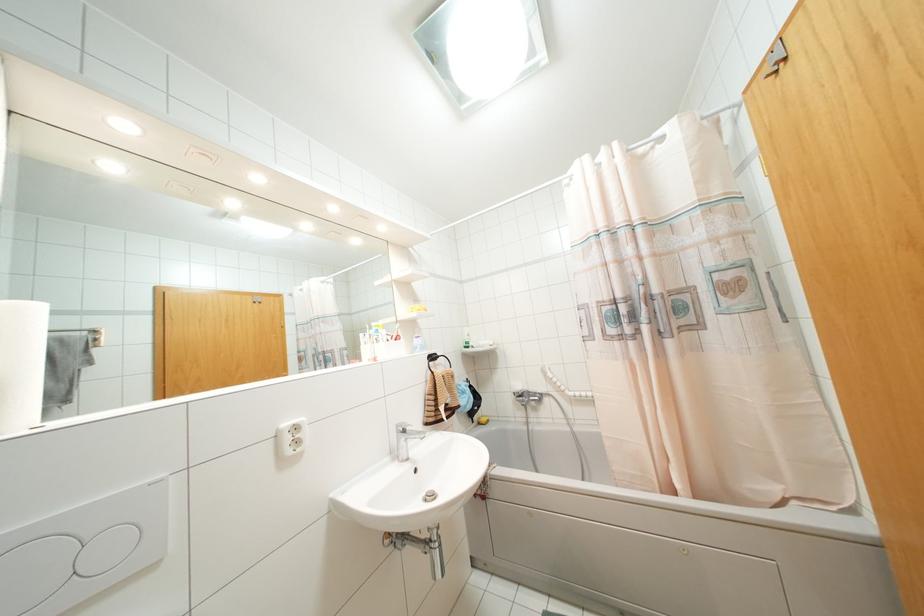
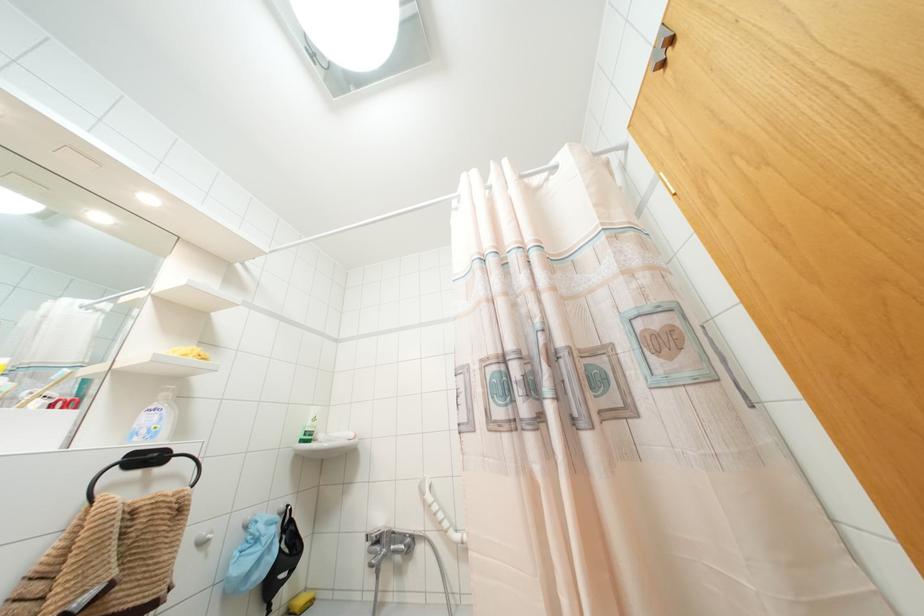
In the second image, find the point that corresponds to (482,419) in the first image.

(299, 601)